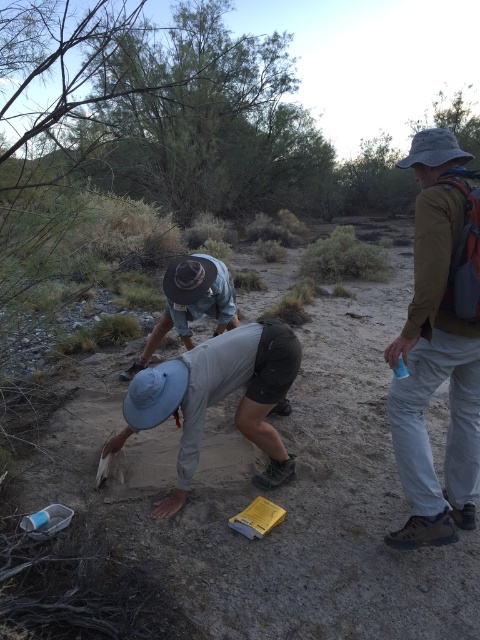
Is point (460, 474) behind point (168, 410)?

Yes, point (460, 474) is farther from viewer.

This screenshot has width=480, height=640. Describe the element at coordinates (439, 344) in the screenshot. I see `greenish-yellow fabric backpack at right` at that location.

The height and width of the screenshot is (640, 480). Identify the location of greenish-yellow fabric backpack at right. [439, 344].

You are a GUI agent. You are given a task and a screenshot of the screen. Output one action in this format:
    pyautogui.click(x=<x>, y=<y>)
    Task: Click on the greenish-yellow fabric backpack at right
    The width and height of the screenshot is (480, 640).
    Given the screenshot: What is the action you would take?
    pyautogui.click(x=439, y=344)

Based on the photo, is greenish-yellow fabric backpack at right bigger than denim shorts at center?

Incorrect, greenish-yellow fabric backpack at right is not larger than denim shorts at center.

Does point (437, 500) come in front of point (177, 285)?

Yes, point (437, 500) is closer to viewer.

Where is `greenish-yellow fabric backpack at right`? Image resolution: width=480 pixels, height=640 pixels. greenish-yellow fabric backpack at right is located at coordinates (439, 344).

Does light gray fabric hat at center lie in front of denim shorts at center?

Yes, it is.

Is point (283, 364) positioned in front of point (202, 307)?

Yes, it is.

At what (x,y) coordinates should I click in order to perform the action: click on light gray fabric hat at center. Please return your answer as a coordinate pair (x, y). The image size is (480, 640). Looking at the image, I should click on (218, 397).

What are the coordinates of `light gray fabric hat at center` in the screenshot? It's located at (218, 397).